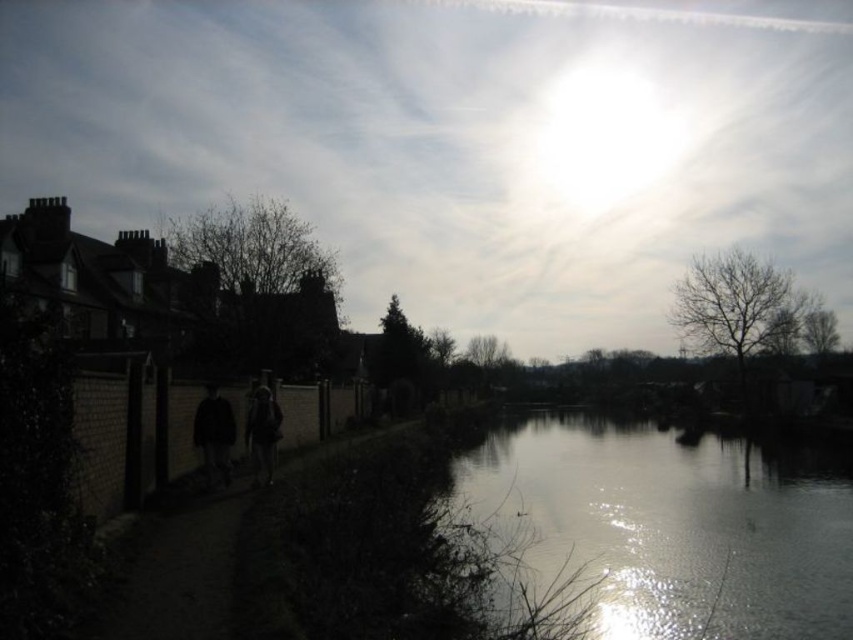
What do you see at coordinates (213, 433) in the screenshot?
I see `dark matte clothing at center` at bounding box center [213, 433].

Locate an element on the screen. The image size is (853, 640). dark matte clothing at center is located at coordinates (213, 433).

Who is more forward, (210, 566) or (254, 416)?

Point (210, 566) is in front.

Does dark dirt path at lower left have a larger size compared to dark fabric jacket at center?

Actually, dark dirt path at lower left might be smaller than dark fabric jacket at center.

Locate an element on the screen. This screenshot has width=853, height=640. dark dirt path at lower left is located at coordinates (207, 564).

The image size is (853, 640). Describe the element at coordinates (672, 524) in the screenshot. I see `silvery reflective water at center` at that location.

What do you see at coordinates (672, 524) in the screenshot? The height and width of the screenshot is (640, 853). I see `silvery reflective water at center` at bounding box center [672, 524].

The image size is (853, 640). Identify the location of silvery reflective water at center. (672, 524).